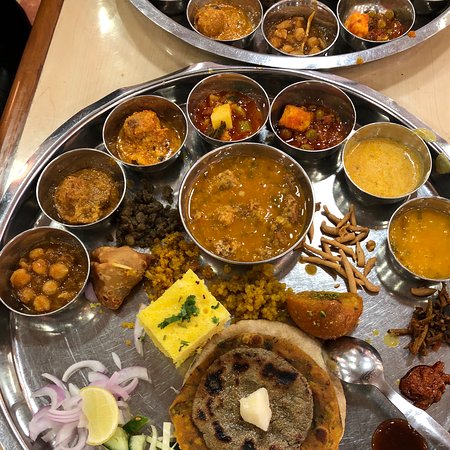
Image resolution: width=450 pixels, height=450 pixels. In order to click on spoon in this screenshot , I will do `click(376, 376)`, `click(420, 423)`, `click(404, 402)`.